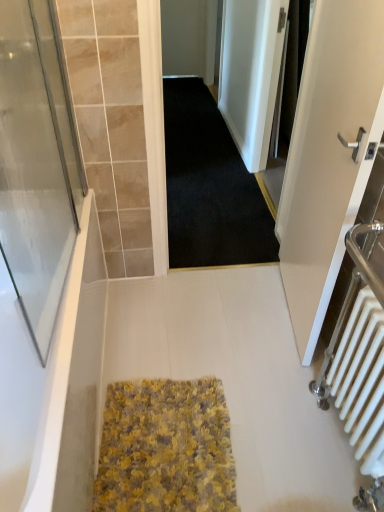
Question: Is white metallic radiator at right wider or thinner than yellow textured rug at center?

Choices:
 (A) wide
 (B) thin

Answer: (B)

Question: Based on their positions, is white metallic radiator at right located to the left or right of yellow textured rug at center?

Choices:
 (A) left
 (B) right

Answer: (B)

Question: Which object is the closest to the white metallic radiator at right?

Choices:
 (A) white matte door at right
 (B) white glossy bathtub at lower left
 (C) black fabric screen door at upper right, marked as the first screen door in a right-to-left arrangement
 (D) black carpet at center
 (E) transparent glass screen door at left, the second screen door positioned from the back

Answer: (A)

Question: Which object is the farthest from the black carpet at center?

Choices:
 (A) white glossy bathtub at lower left
 (B) black fabric screen door at upper right, marked as the first screen door in a right-to-left arrangement
 (C) white matte door at right
 (D) white metallic radiator at right
 (E) yellow textured rug at center

Answer: (D)